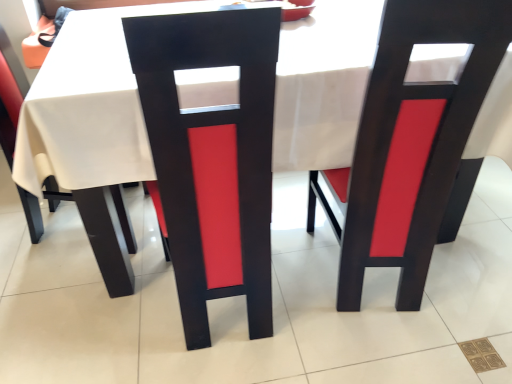
Where is `vacant point to the right of matte black chair at center, positioned as the 2th chair in left-to-right order`? The image size is (512, 384). vacant point to the right of matte black chair at center, positioned as the 2th chair in left-to-right order is located at coordinates coord(310,305).